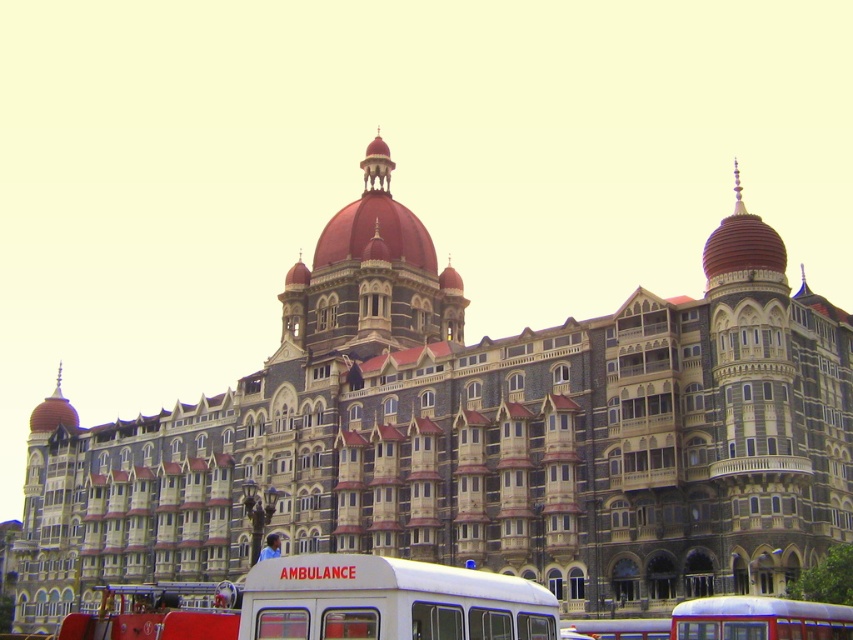
Which is behind, point (247, 579) or point (608, 628)?

The point (608, 628) is behind.

Which of these two, white matte ambulance at lower center or white plastic bus at center, stands shorter?

Standing shorter between the two is white plastic bus at center.

Identify the location of white matte ambulance at lower center. (389, 600).

Is white matte ambulance at lower center positioned at the back of blue metallic bus at lower right?

No, white matte ambulance at lower center is closer to the viewer.

Can you confirm if white matte ambulance at lower center is thinner than blue metallic bus at lower right?

No, white matte ambulance at lower center is not thinner than blue metallic bus at lower right.

In order to click on white matte ambulance at lower center in this screenshot , I will do tap(389, 600).

I want to click on white matte ambulance at lower center, so click(x=389, y=600).

Image resolution: width=853 pixels, height=640 pixels. What do you see at coordinates (759, 618) in the screenshot?
I see `blue metallic bus at lower right` at bounding box center [759, 618].

Who is more distant from viewer, (x=799, y=609) or (x=573, y=627)?

Point (x=573, y=627)

Where is `blue metallic bus at lower right`? The height and width of the screenshot is (640, 853). blue metallic bus at lower right is located at coordinates (759, 618).

Identify the location of blue metallic bus at lower right. The width and height of the screenshot is (853, 640). 759,618.